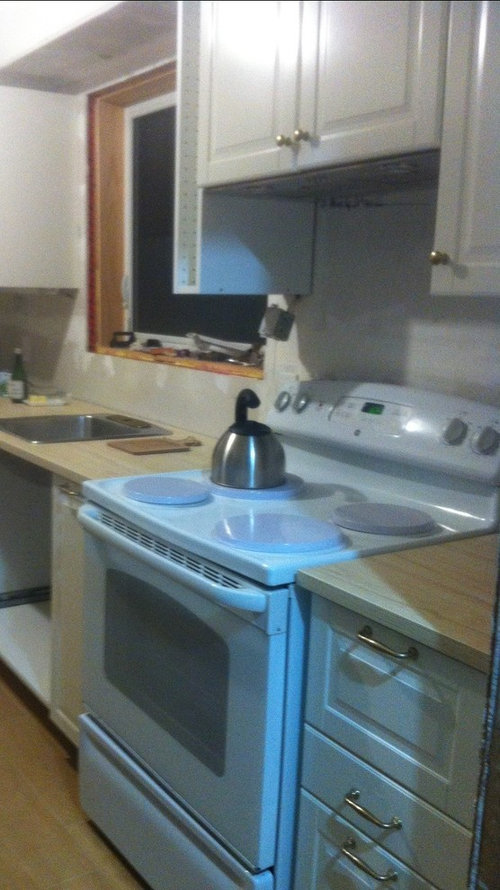
The height and width of the screenshot is (890, 500). Identify the location of oven door. (193, 669).